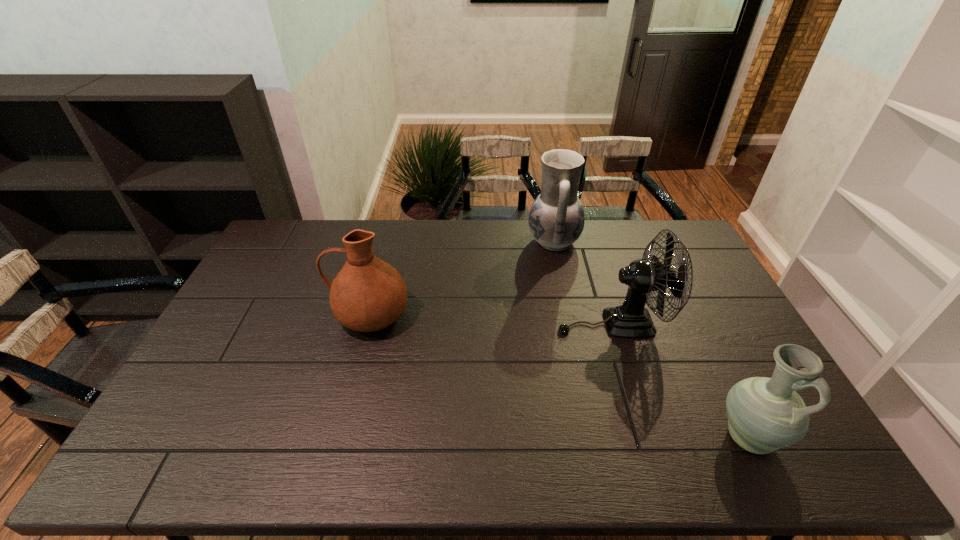
Locate an element on the screen. The width and height of the screenshot is (960, 540). blank space located 0.310m in front of the fan, indicating the direction of air flow is located at coordinates (457, 323).

Where is `free region located 0.350m in front of the fan, indicating the direction of air flow`? free region located 0.350m in front of the fan, indicating the direction of air flow is located at coordinates (444, 323).

Image resolution: width=960 pixels, height=540 pixels. In order to click on blank space located 0.110m in front of the fan, indicating the direction of air flow in this screenshot , I will do `click(521, 323)`.

Find the location of `blank area located 0.140m on the side of the leftmost pitcher with the handle`. blank area located 0.140m on the side of the leftmost pitcher with the handle is located at coordinates (287, 315).

Locate an element on the screen. The image size is (960, 540). free space located on the side of the leftmost pitcher with the handle is located at coordinates (268, 315).

Find the location of a particular element. This screenshot has height=540, width=960. free space located on the side of the leftmost pitcher with the handle is located at coordinates (287, 315).

You are a GUI agent. You are given a task and a screenshot of the screen. Output one action in this format:
    pyautogui.click(x=<x>, y=<y>)
    Task: Click on the object situated at the far edge
    
    Given the screenshot: What is the action you would take?
    pyautogui.click(x=556, y=219)

You are a GUI agent. You are given a task and a screenshot of the screen. Output one action in this format:
    pyautogui.click(x=<x>, y=<y>)
    Task: Click on the object at the near edge
    
    Given the screenshot: What is the action you would take?
    pyautogui.click(x=765, y=414)

Image resolution: width=960 pixels, height=540 pixels. What are the coordinates of `object that is at the right edge` in the screenshot? It's located at (765, 414).

The width and height of the screenshot is (960, 540). What are the coordinates of `object present at the near right corner` in the screenshot? It's located at (765, 414).